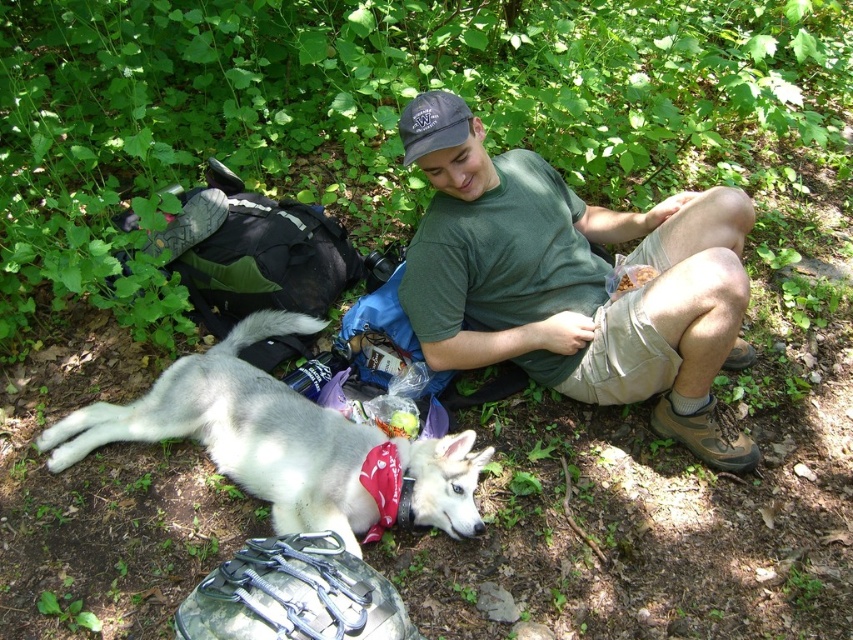
You are a photographer trying to capture the scene from above. You notice the white fur dog at lower left and the dark gray fabric baseball cap at center. Which object is positioned lower in the image?

The white fur dog at lower left is positioned lower than the dark gray fabric baseball cap at center.

You are an AI analyzing the spatial coordinates of objects in an image. The scene shows a man and his dog resting in a forest. You need to determine the exact 2D coordinates of the green cotton shirt at center. What are the coordinates?

The 2D coordinates of the green cotton shirt at center are at point [581,289].

You are a photographer trying to capture the scene. You notice the white fur dog at lower left and the dark gray fabric baseball cap at center. Which object is positioned closer to your camera lens?

The white fur dog at lower left is closer to the viewer than the dark gray fabric baseball cap at center, so it is positioned closer to the camera lens.